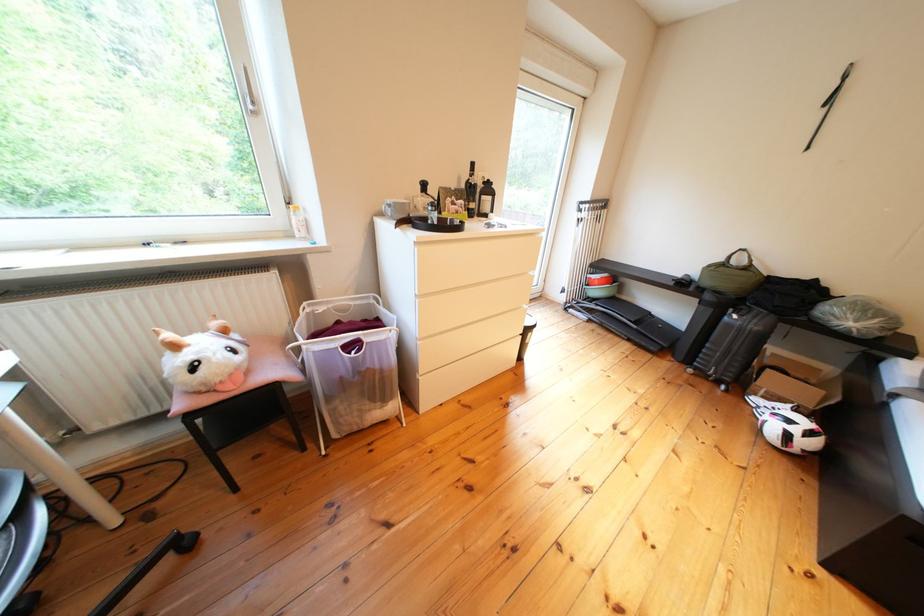
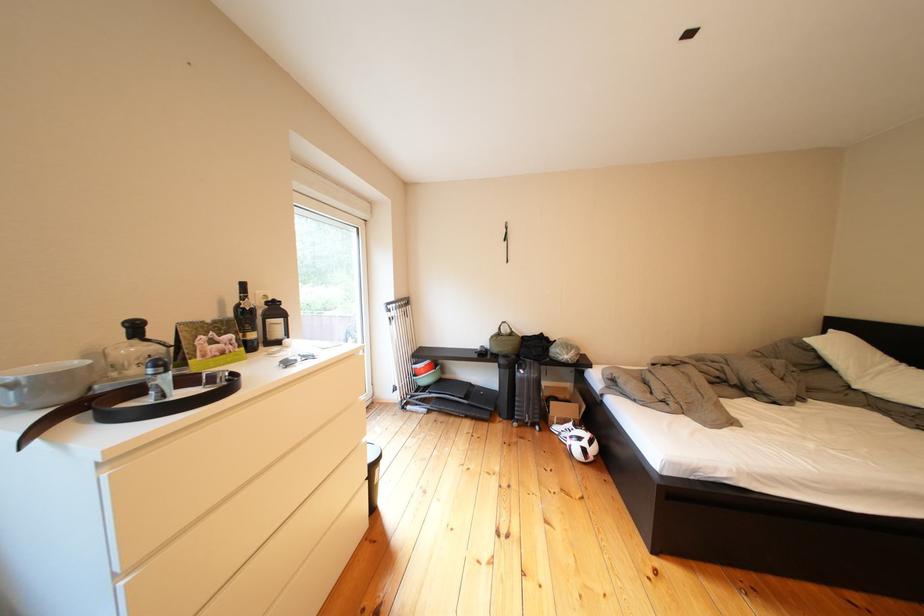
In the second image, find the point that corresponds to (x=723, y=301) in the first image.

(516, 366)